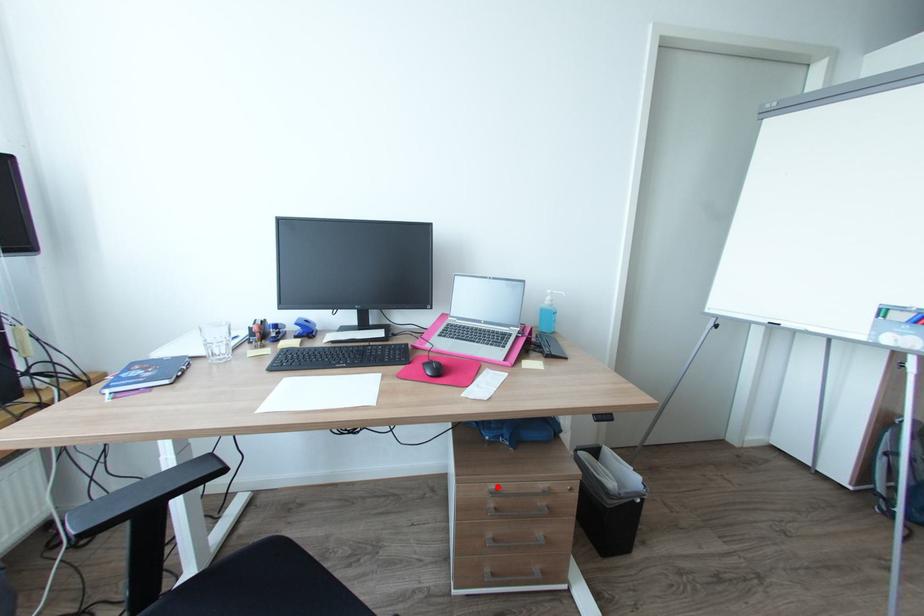
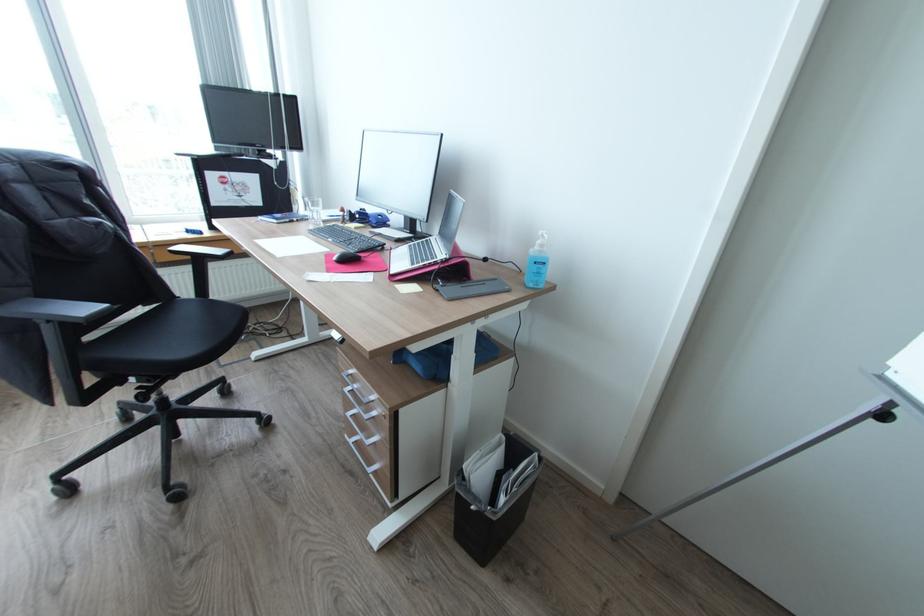
Find the pixel in the second image that matches the highlighted location in the first image.

(357, 371)